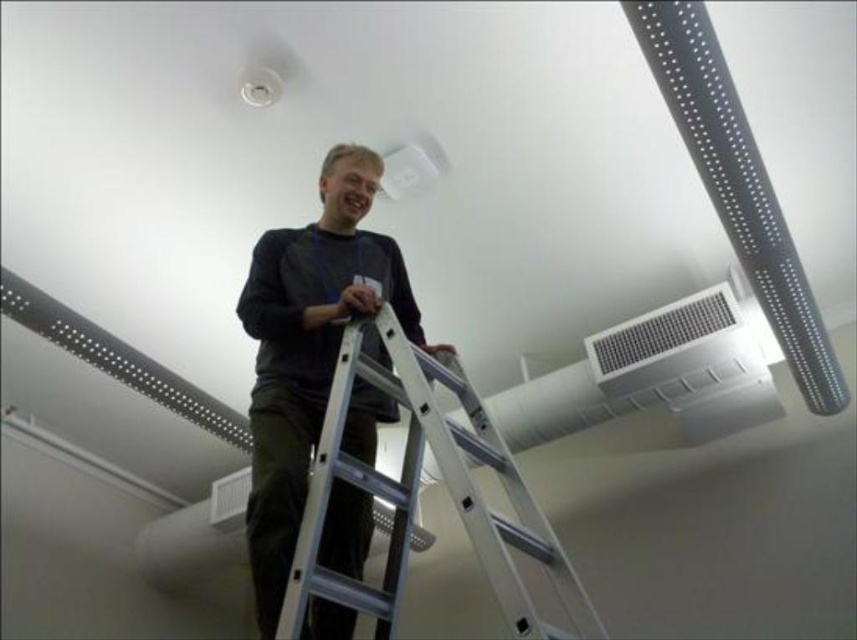
You are a worker in the room and need to determine which point is closer to you. You see two points in the image labeled as point (271, 314) and point (496, 573). Which point is closer to you?

Answer: Point (271, 314) is closer to you because it is further to the viewer than point (496, 573).

You are an interior designer assessing the room layout. You notice the dark gray matte shirt at center and the metallic silver air conditioning at upper center. Which object takes up more space in the image?

The dark gray matte shirt at center has a larger size compared to the metallic silver air conditioning at upper center, so it takes up more space in the image.

You are a contractor assessing the safety of the ladder placement. Given the height of the silver metallic ladder at center and the metallic silver air conditioning at upper center, which object is taller?

The silver metallic ladder at center is taller than the metallic silver air conditioning at upper center according to the description.